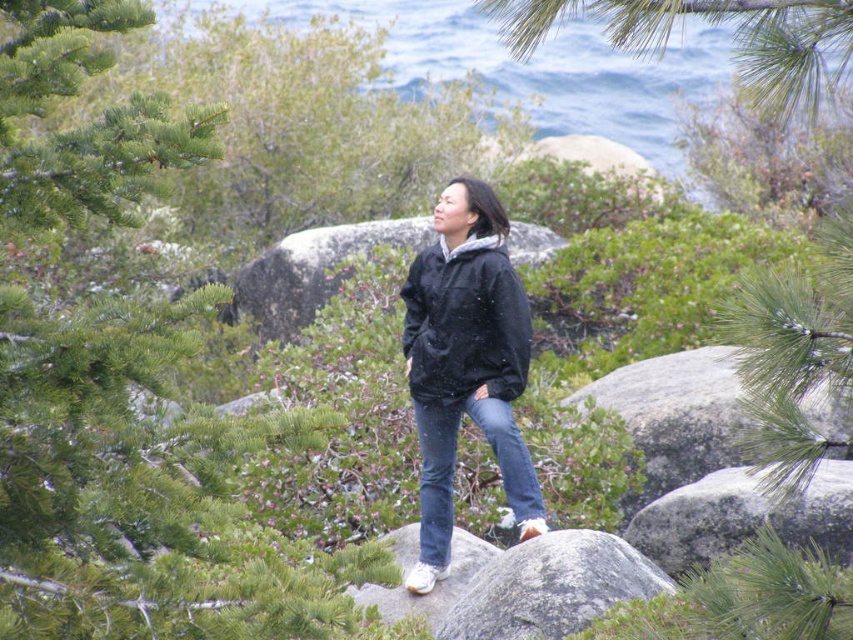
You are a hiker who wants to place a small backpack between the green pine branch at upper center and the gray rock at center. Can you fit it there?

The distance between the green pine branch at upper center and the gray rock at center is 13.93 feet, so yes, you can fit a small backpack there.

You are a hiker who wants to sit down for a rest. You see two boulders in the scene, the smooth gray boulder at center and the gray rough boulder at center. Which one would you choose to sit on if you prefer a larger surface area?

The smooth gray boulder at center is larger in size than the gray rough boulder at center, so you should choose the smooth gray boulder at center to sit on for a larger surface area.